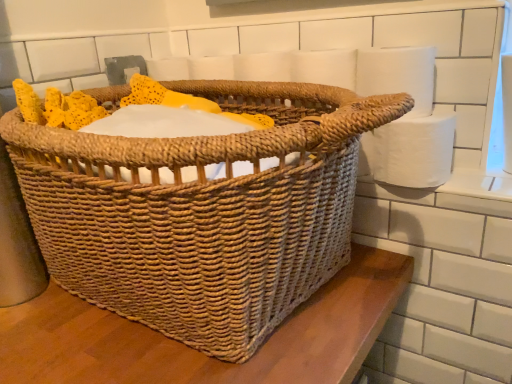
Question: Can you confirm if woven natural picnic basket at center is positioned to the right of white paper at right, which ranks as the second toilet paper in top-to-bottom order?

Choices:
 (A) yes
 (B) no

Answer: (B)

Question: Could white paper at right, which ranks as the second toilet paper in top-to-bottom order, be considered to be inside woven natural picnic basket at center?

Choices:
 (A) yes
 (B) no

Answer: (B)

Question: From the image's perspective, is woven natural picnic basket at center under white paper at right, placed as the 1th toilet paper when sorted from bottom to top?

Choices:
 (A) no
 (B) yes

Answer: (B)

Question: Are woven natural picnic basket at center and white paper at right, placed as the 1th toilet paper when sorted from bottom to top, far apart?

Choices:
 (A) yes
 (B) no

Answer: (B)

Question: Is the depth of woven natural picnic basket at center greater than that of white paper at right, which ranks as the second toilet paper in top-to-bottom order?

Choices:
 (A) yes
 (B) no

Answer: (B)

Question: Is woven natural picnic basket at center looking in the opposite direction of white paper at right, placed as the 1th toilet paper when sorted from bottom to top?

Choices:
 (A) yes
 (B) no

Answer: (A)

Question: Considering the relative sizes of woven natural picnic basket at center and white matte toilet paper at upper right, placed as the 2th toilet paper when sorted from bottom to top, in the image provided, is woven natural picnic basket at center taller than white matte toilet paper at upper right, placed as the 2th toilet paper when sorted from bottom to top,?

Choices:
 (A) no
 (B) yes

Answer: (B)

Question: From the image's perspective, does woven natural picnic basket at center appear lower than white matte toilet paper at upper right, acting as the 1th toilet paper starting from the top?

Choices:
 (A) no
 (B) yes

Answer: (B)

Question: Is woven natural picnic basket at center far from white matte toilet paper at upper right, acting as the 1th toilet paper starting from the top?

Choices:
 (A) yes
 (B) no

Answer: (B)

Question: Is woven natural picnic basket at center to the right of white matte toilet paper at upper right, acting as the 1th toilet paper starting from the top, from the viewer's perspective?

Choices:
 (A) no
 (B) yes

Answer: (A)

Question: Is woven natural picnic basket at center shorter than white matte toilet paper at upper right, placed as the 2th toilet paper when sorted from bottom to top?

Choices:
 (A) no
 (B) yes

Answer: (A)

Question: From a real-world perspective, is woven natural picnic basket at center physically below white matte toilet paper at upper right, acting as the 1th toilet paper starting from the top?

Choices:
 (A) no
 (B) yes

Answer: (B)

Question: Is white paper at right, placed as the 1th toilet paper when sorted from bottom to top, placed right next to woven natural picnic basket at center?

Choices:
 (A) yes
 (B) no

Answer: (B)